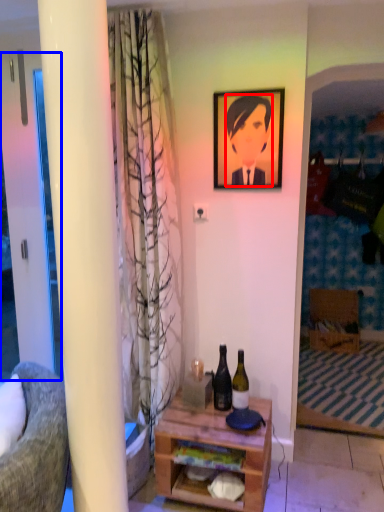
Question: Which object appears closest to the camera in this image, person (highlighted by a red box) or screen door (highlighted by a blue box)?

Choices:
 (A) person
 (B) screen door

Answer: (A)